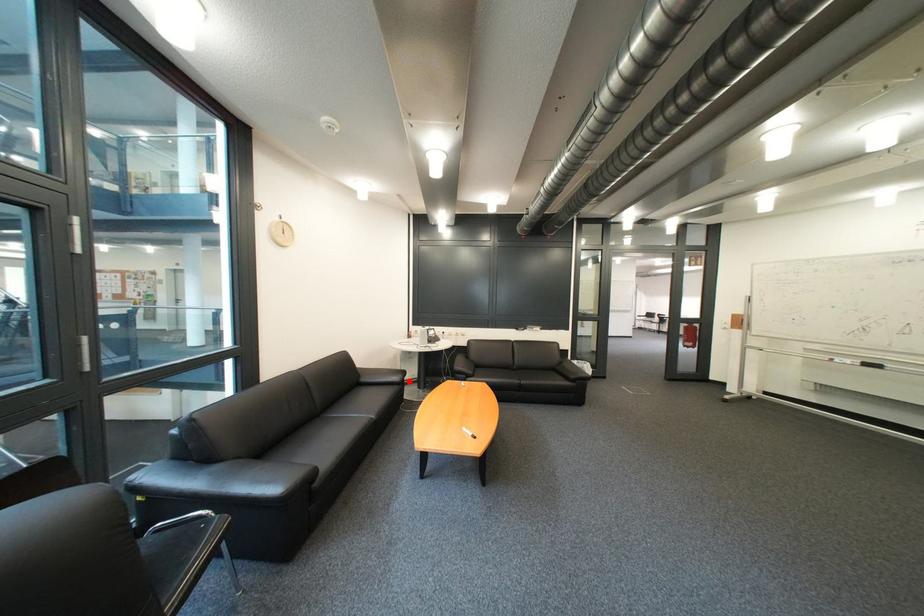
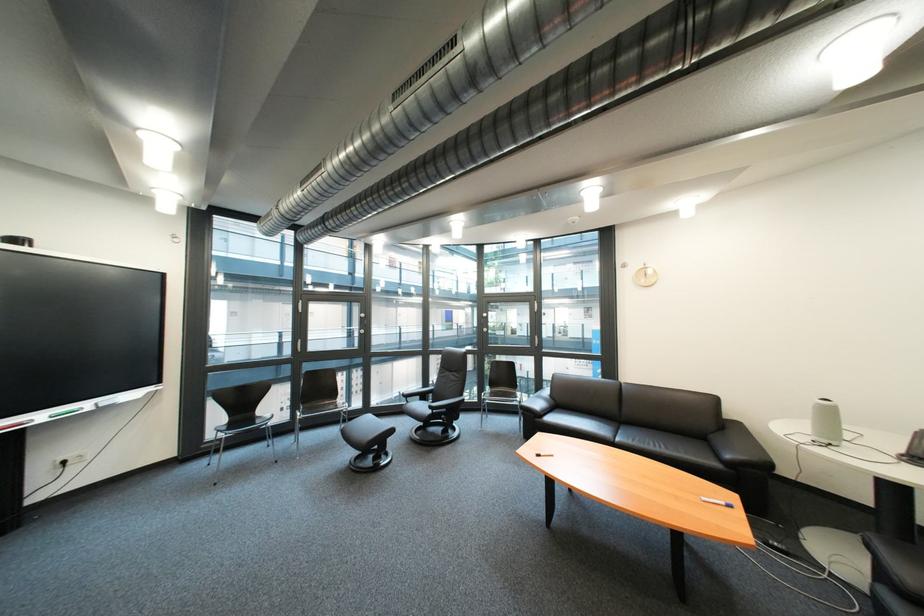
Find the pixel in the second image that matches the highlighted location in the first image.

(742, 458)